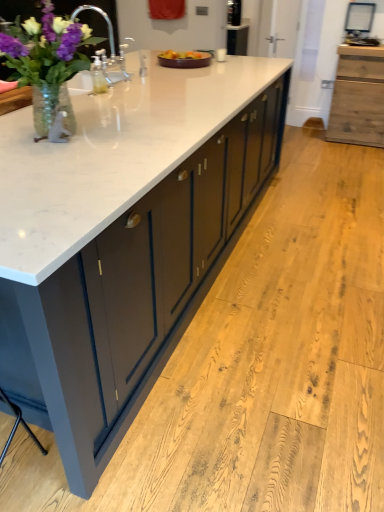
At what (x,y) coordinates should I click in order to perform the action: click on free space to the right of clear glass vase at left. Please return your answer as a coordinate pair (x, y). This screenshot has width=384, height=512. Looking at the image, I should click on (149, 136).